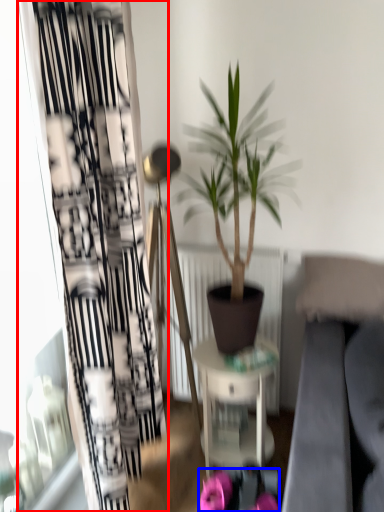
Question: Which object is closer to the camera taking this photo, curtain (highlighted by a red box) or flower (highlighted by a blue box)?

Choices:
 (A) curtain
 (B) flower

Answer: (A)